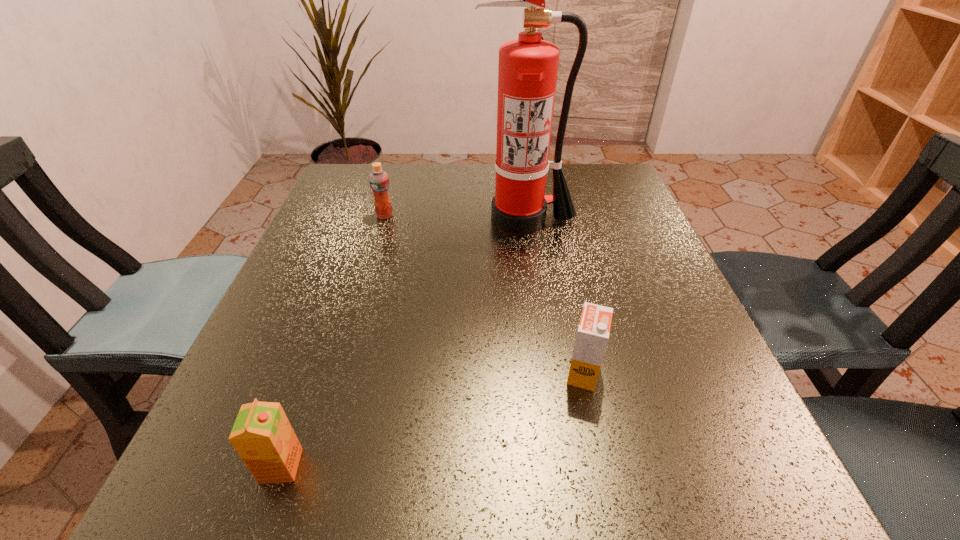
Find the location of a particular element. This screenshot has width=960, height=540. orange juice at the far edge is located at coordinates (379, 181).

Locate an element on the screen. object at the near edge is located at coordinates (262, 435).

At what (x,y) coordinates should I click in order to perform the action: click on object present at the right edge. Please return your answer as a coordinate pair (x, y). Image resolution: width=960 pixels, height=540 pixels. Looking at the image, I should click on (527, 71).

Locate an element on the screen. object located in the far left corner section of the desktop is located at coordinates (379, 181).

Where is `object at the near left corner`? Image resolution: width=960 pixels, height=540 pixels. object at the near left corner is located at coordinates (262, 435).

Identify the location of object that is at the far right corner. (527, 71).

Where is `vacant region at the far edge of the desktop`? vacant region at the far edge of the desktop is located at coordinates (422, 173).

At what (x,y) coordinates should I click in order to perform the action: click on free space at the near edge of the desktop. Please return your answer as a coordinate pair (x, y). This screenshot has height=540, width=960. Looking at the image, I should click on (610, 475).

This screenshot has height=540, width=960. I want to click on vacant area at the left edge, so click(x=309, y=305).

I want to click on vacant space at the right edge of the desktop, so tap(590, 220).